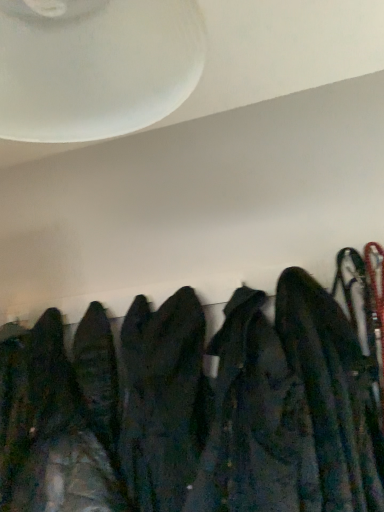
Question: From a real-world perspective, is dark blue fabric jacket at right over white frosted glass fan at upper center?

Choices:
 (A) yes
 (B) no

Answer: (B)

Question: Is dark blue fabric jacket at right smaller than white frosted glass fan at upper center?

Choices:
 (A) yes
 (B) no

Answer: (B)

Question: Does dark blue fabric jacket at right have a lesser height compared to white frosted glass fan at upper center?

Choices:
 (A) no
 (B) yes

Answer: (A)

Question: Can we say dark blue fabric jacket at right lies outside white frosted glass fan at upper center?

Choices:
 (A) yes
 (B) no

Answer: (A)

Question: Considering the relative sizes of dark blue fabric jacket at right and white frosted glass fan at upper center in the image provided, is dark blue fabric jacket at right thinner than white frosted glass fan at upper center?

Choices:
 (A) yes
 (B) no

Answer: (B)

Question: Can you confirm if dark blue fabric jacket at right is bigger than white frosted glass fan at upper center?

Choices:
 (A) no
 (B) yes

Answer: (B)

Question: Can you confirm if white frosted glass fan at upper center is taller than dark blue fabric jacket at right?

Choices:
 (A) no
 (B) yes

Answer: (A)

Question: Is white frosted glass fan at upper center touching dark blue fabric jacket at right?

Choices:
 (A) yes
 (B) no

Answer: (B)

Question: Is dark blue fabric jacket at right located within white frosted glass fan at upper center?

Choices:
 (A) no
 (B) yes

Answer: (A)

Question: Does white frosted glass fan at upper center turn towards dark blue fabric jacket at right?

Choices:
 (A) no
 (B) yes

Answer: (A)

Question: Can we say white frosted glass fan at upper center lies outside dark blue fabric jacket at right?

Choices:
 (A) yes
 (B) no

Answer: (A)

Question: Considering the relative sizes of white frosted glass fan at upper center and dark blue fabric jacket at right in the image provided, is white frosted glass fan at upper center shorter than dark blue fabric jacket at right?

Choices:
 (A) yes
 (B) no

Answer: (A)

Question: In the image, is white frosted glass fan at upper center on the left side or the right side of dark blue fabric jacket at right?

Choices:
 (A) right
 (B) left

Answer: (B)